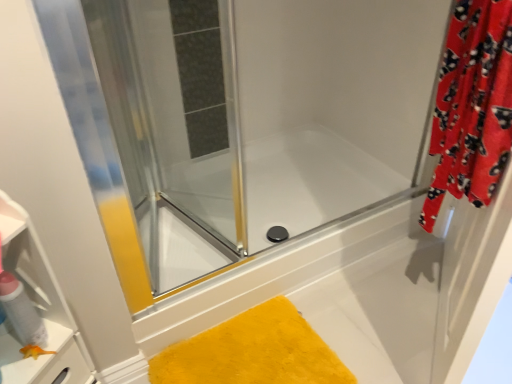
Question: From a real-world perspective, is transparent glass shower door at upper left under red fuzzy curtain at right?

Choices:
 (A) no
 (B) yes

Answer: (B)

Question: Is transparent glass shower door at upper left far from red fuzzy curtain at right?

Choices:
 (A) no
 (B) yes

Answer: (A)

Question: Would you say transparent glass shower door at upper left is outside red fuzzy curtain at right?

Choices:
 (A) yes
 (B) no

Answer: (A)

Question: Is transparent glass shower door at upper left wider than red fuzzy curtain at right?

Choices:
 (A) no
 (B) yes

Answer: (B)

Question: Is transparent glass shower door at upper left to the left of red fuzzy curtain at right from the viewer's perspective?

Choices:
 (A) yes
 (B) no

Answer: (A)

Question: In terms of height, does yellow fluffy bath mat at lower center look taller or shorter compared to red fuzzy curtain at right?

Choices:
 (A) tall
 (B) short

Answer: (B)

Question: Is point (268, 357) closer or farther from the camera than point (474, 82)?

Choices:
 (A) closer
 (B) farther

Answer: (B)

Question: From the image's perspective, is yellow fluffy bath mat at lower center positioned above or below red fuzzy curtain at right?

Choices:
 (A) below
 (B) above

Answer: (A)

Question: From a real-world perspective, is yellow fluffy bath mat at lower center positioned above or below red fuzzy curtain at right?

Choices:
 (A) above
 (B) below

Answer: (B)

Question: In terms of size, does transparent glass shower door at upper left appear bigger or smaller than matte white spray can at left?

Choices:
 (A) big
 (B) small

Answer: (A)

Question: From the image's perspective, relative to matte white spray can at left, is transparent glass shower door at upper left above or below?

Choices:
 (A) above
 (B) below

Answer: (A)

Question: Considering the positions of transparent glass shower door at upper left and matte white spray can at left in the image, is transparent glass shower door at upper left wider or thinner than matte white spray can at left?

Choices:
 (A) thin
 (B) wide

Answer: (B)

Question: From their relative heights in the image, would you say transparent glass shower door at upper left is taller or shorter than matte white spray can at left?

Choices:
 (A) tall
 (B) short

Answer: (A)

Question: From the image's perspective, relative to yellow fluffy bath mat at lower center, is red fuzzy curtain at right above or below?

Choices:
 (A) above
 (B) below

Answer: (A)

Question: Looking at their shapes, would you say red fuzzy curtain at right is wider or thinner than yellow fluffy bath mat at lower center?

Choices:
 (A) wide
 (B) thin

Answer: (B)